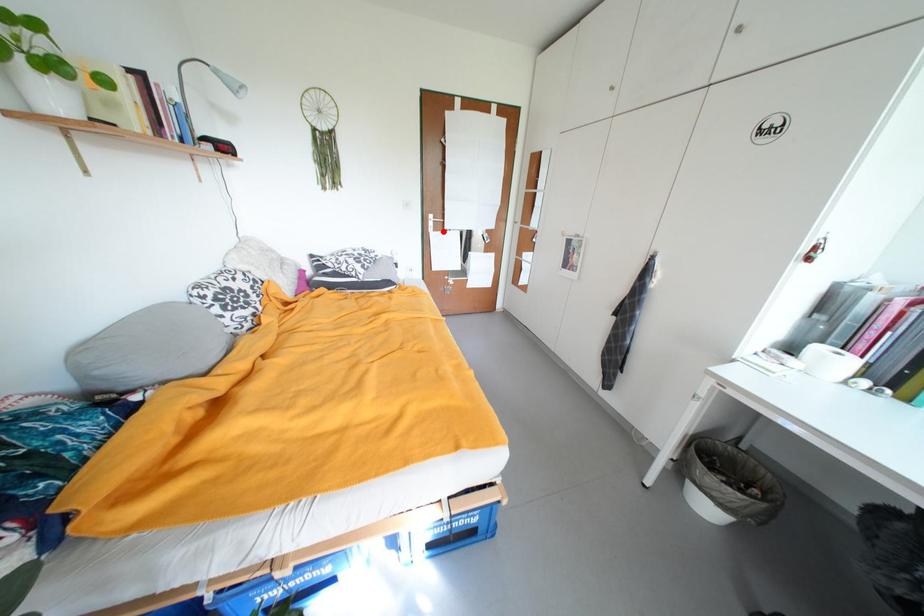
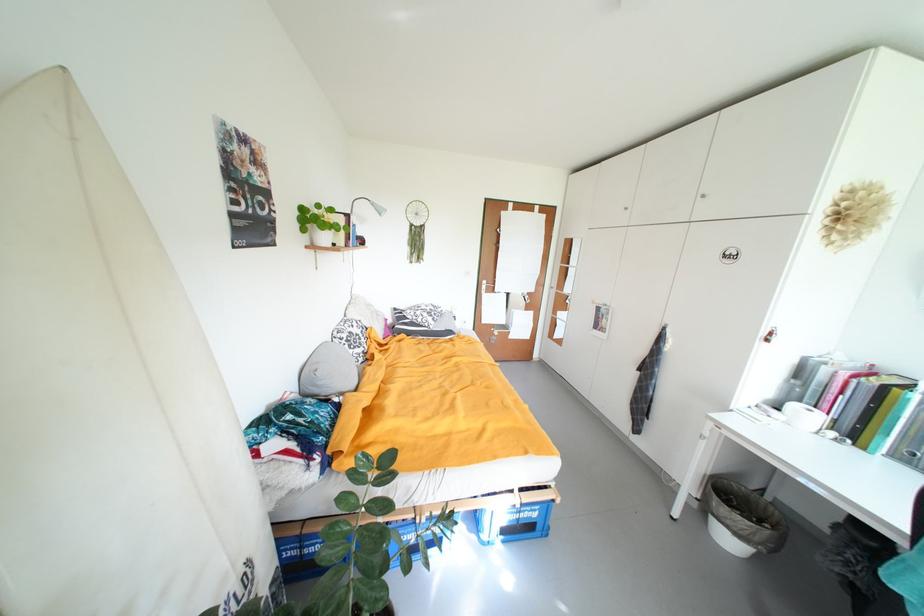
Where in the second image is the point corresponding to the highlighted location from the first image?

(494, 294)